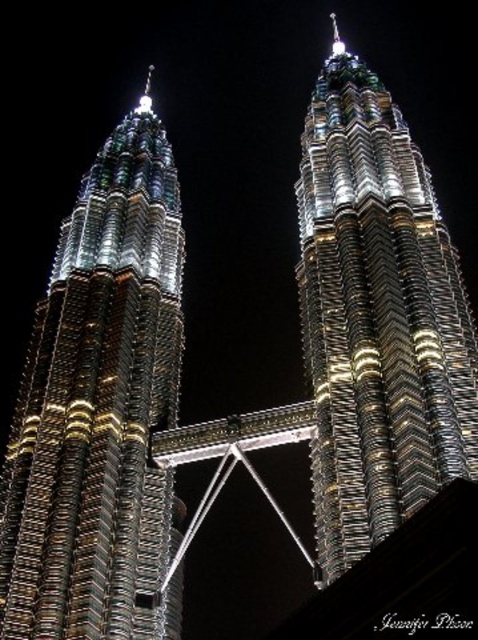
Question: Does metallic glass skyscraper at left have a lesser width compared to metallic glass skyscraper at center?

Choices:
 (A) no
 (B) yes

Answer: (A)

Question: Which point is closer to the camera?

Choices:
 (A) (324, 512)
 (B) (177, 284)

Answer: (A)

Question: Is metallic glass skyscraper at left positioned at the back of metallic glass skyscraper at center?

Choices:
 (A) yes
 (B) no

Answer: (A)

Question: Can you confirm if metallic glass skyscraper at left is positioned above metallic glass skyscraper at center?

Choices:
 (A) no
 (B) yes

Answer: (A)